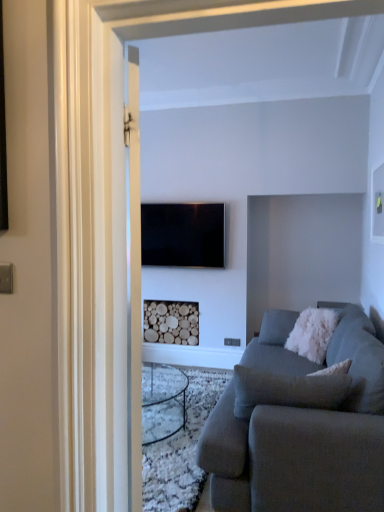
Question: Is flat screen tv at center with gray fabric couch at lower right?

Choices:
 (A) no
 (B) yes

Answer: (A)

Question: Can you confirm if flat screen tv at center is wider than gray fabric couch at lower right?

Choices:
 (A) yes
 (B) no

Answer: (B)

Question: From a real-world perspective, is flat screen tv at center over gray fabric couch at lower right?

Choices:
 (A) no
 (B) yes

Answer: (B)

Question: Considering the relative positions of flat screen tv at center and gray fabric couch at lower right in the image provided, is flat screen tv at center to the right of gray fabric couch at lower right from the viewer's perspective?

Choices:
 (A) no
 (B) yes

Answer: (A)

Question: Does flat screen tv at center have a lesser height compared to gray fabric couch at lower right?

Choices:
 (A) no
 (B) yes

Answer: (B)

Question: From a real-world perspective, is flat screen tv at center under gray fabric couch at lower right?

Choices:
 (A) no
 (B) yes

Answer: (A)

Question: Can you confirm if white fluffy pillow at right is bigger than flat screen tv at center?

Choices:
 (A) yes
 (B) no

Answer: (A)

Question: Could you tell me if white fluffy pillow at right is turned towards flat screen tv at center?

Choices:
 (A) yes
 (B) no

Answer: (B)

Question: Is white fluffy pillow at right far from flat screen tv at center?

Choices:
 (A) yes
 (B) no

Answer: (A)

Question: Considering the relative sizes of white fluffy pillow at right and flat screen tv at center in the image provided, is white fluffy pillow at right taller than flat screen tv at center?

Choices:
 (A) yes
 (B) no

Answer: (B)

Question: Does white fluffy pillow at right contain flat screen tv at center?

Choices:
 (A) yes
 (B) no

Answer: (B)

Question: Is white fluffy pillow at right thinner than flat screen tv at center?

Choices:
 (A) yes
 (B) no

Answer: (B)

Question: From a real-world perspective, does flat screen tv at center sit lower than wooden logs at center?

Choices:
 (A) no
 (B) yes

Answer: (A)